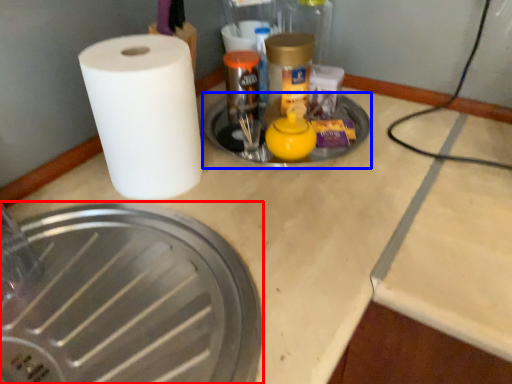
Question: Which point is further to the camera, manhole cover (highlighted by a red box) or manhole cover (highlighted by a blue box)?

Choices:
 (A) manhole cover
 (B) manhole cover

Answer: (B)